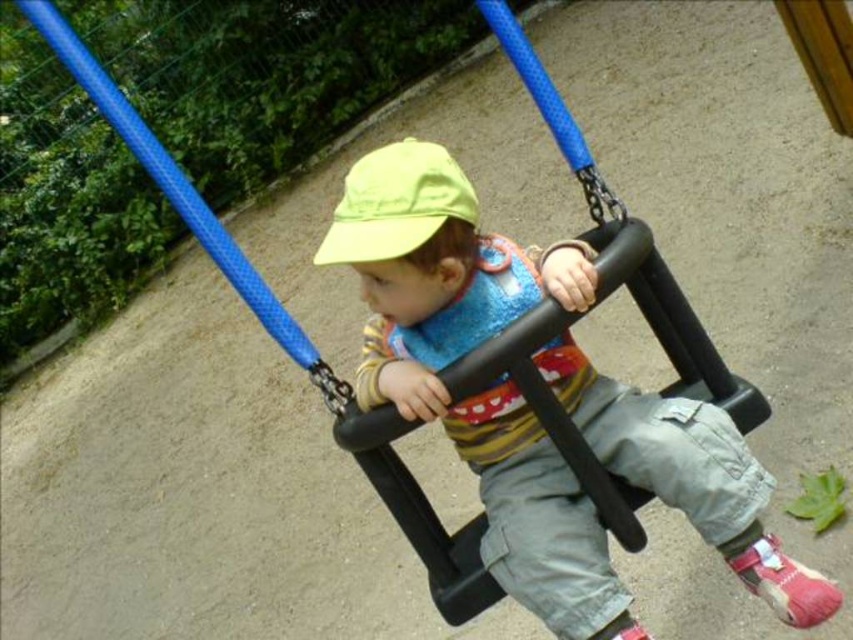
Question: Which point appears closest to the camera in this image?

Choices:
 (A) (415, 188)
 (B) (379, 170)

Answer: (A)

Question: Among these points, which one is farthest from the camera?

Choices:
 (A) (426, 236)
 (B) (430, 253)

Answer: (B)

Question: Which object is closer to the camera taking this photo?

Choices:
 (A) matte black swing seat at center
 (B) yellow fabric hat at center

Answer: (A)

Question: Is matte black swing seat at center smaller than yellow fabric hat at center?

Choices:
 (A) no
 (B) yes

Answer: (A)

Question: Does matte black swing seat at center have a greater width compared to yellow fabric hat at center?

Choices:
 (A) no
 (B) yes

Answer: (B)

Question: Considering the relative positions of matte black swing seat at center and yellow fabric hat at center in the image provided, where is matte black swing seat at center located with respect to yellow fabric hat at center?

Choices:
 (A) above
 (B) below

Answer: (B)